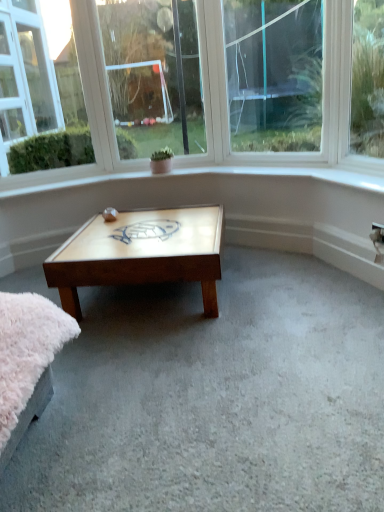
Identify the location of clear glass window at upper left, placed as the 3th window when sorted from right to left. (38, 97).

Describe the element at coordinates (110, 214) in the screenshot. I see `wooden turtle at center` at that location.

What do you see at coordinates (274, 74) in the screenshot?
I see `clear glass window at upper center, the 1th window when ordered from right to left` at bounding box center [274, 74].

Identify the location of clear glass window at upper center, positioned as the second window in right-to-left order. (154, 76).

Is clear glass window at upper center, positioned as the second window in right-to-left order, inside wooden turtle design at center?

No, clear glass window at upper center, positioned as the second window in right-to-left order, is not a part of wooden turtle design at center.

Considering the positions of objects wooden turtle design at center and clear glass window at upper center, which is the second window in left-to-right order, in the image provided, who is behind, wooden turtle design at center or clear glass window at upper center, which is the second window in left-to-right order,?

clear glass window at upper center, which is the second window in left-to-right order.

Is point (53, 274) positioned in front of point (183, 138)?

That is True.

From the image's perspective, which one is positioned higher, wooden turtle at center or wooden turtle design at center?

wooden turtle at center appears higher in the image.

From a real-world perspective, is wooden turtle at center physically below wooden turtle design at center?

Actually, wooden turtle at center is physically above wooden turtle design at center in the real world.

Does wooden turtle at center have a smaller size compared to wooden turtle design at center?

Indeed, wooden turtle at center has a smaller size compared to wooden turtle design at center.

From a real-world perspective, who is located higher, wooden turtle at center or clear glass window at upper left, placed as the 3th window when sorted from right to left?

In real-world perspective, clear glass window at upper left, placed as the 3th window when sorted from right to left, is above.

Considering the positions of objects wooden turtle at center and clear glass window at upper left, placed as the 3th window when sorted from right to left, in the image provided, who is behind, wooden turtle at center or clear glass window at upper left, placed as the 3th window when sorted from right to left,?

wooden turtle at center is behind.

Is wooden turtle at center to the right of clear glass window at upper left, the 1th window when ordered from left to right, from the viewer's perspective?

Yes.

Identify the location of table below the clear glass window at upper left, placed as the 3th window when sorted from right to left (from the image's perspective). The image size is (384, 512). (110, 214).

Does clear glass window at upper left, the 1th window when ordered from left to right, turn towards clear glass window at upper center, the 1th window when ordered from right to left?

No, clear glass window at upper left, the 1th window when ordered from left to right, is not aimed at clear glass window at upper center, the 1th window when ordered from right to left.

Is clear glass window at upper left, placed as the 3th window when sorted from right to left, next to clear glass window at upper center, the third window when ordered from left to right, and touching it?

No, clear glass window at upper left, placed as the 3th window when sorted from right to left, is not next to clear glass window at upper center, the third window when ordered from left to right.

Identify the location of window below the clear glass window at upper center, the 1th window when ordered from right to left (from the image's perspective). Image resolution: width=384 pixels, height=512 pixels. click(38, 97).

Looking at this image, from a real-world perspective, which is physically below, clear glass window at upper left, placed as the 3th window when sorted from right to left, or clear glass window at upper center, the 1th window when ordered from right to left?

clear glass window at upper center, the 1th window when ordered from right to left, is physically lower.

Considering the positions of point (73, 123) and point (170, 41), is point (73, 123) closer or farther from the camera than point (170, 41)?

Point (73, 123) is farther from the camera than point (170, 41).

Between clear glass window at upper left, placed as the 3th window when sorted from right to left, and clear glass window at upper center, which is the second window in left-to-right order, which one appears on the right side from the viewer's perspective?

From the viewer's perspective, clear glass window at upper center, which is the second window in left-to-right order, appears more on the right side.

Is clear glass window at upper left, the 1th window when ordered from left to right, taller than clear glass window at upper center, positioned as the second window in right-to-left order?

Yes, clear glass window at upper left, the 1th window when ordered from left to right, is taller than clear glass window at upper center, positioned as the second window in right-to-left order.

Is clear glass window at upper left, placed as the 3th window when sorted from right to left, facing away from clear glass window at upper center, positioned as the second window in right-to-left order?

No.

From a real-world perspective, is wooden turtle design at center positioned over wooden turtle at center based on gravity?

No.

From the image's perspective, which one is positioned lower, wooden turtle design at center or wooden turtle at center?

wooden turtle design at center is shown below in the image.

How many degrees apart are the facing directions of wooden turtle design at center and wooden turtle at center?

The facing directions of wooden turtle design at center and wooden turtle at center are 4.19 degrees apart.

Looking at this image, measure the distance from clear glass window at upper center, positioned as the second window in right-to-left order, to clear glass window at upper center, the 1th window when ordered from right to left.

clear glass window at upper center, positioned as the second window in right-to-left order, and clear glass window at upper center, the 1th window when ordered from right to left, are 53.28 centimeters apart from each other.

Considering the sizes of clear glass window at upper center, which is the second window in left-to-right order, and clear glass window at upper center, the 1th window when ordered from right to left, in the image, is clear glass window at upper center, which is the second window in left-to-right order, wider or thinner than clear glass window at upper center, the 1th window when ordered from right to left,?

Clearly, clear glass window at upper center, which is the second window in left-to-right order, has more width compared to clear glass window at upper center, the 1th window when ordered from right to left.

Are clear glass window at upper center, which is the second window in left-to-right order, and clear glass window at upper center, the third window when ordered from left to right, beside each other?

No, clear glass window at upper center, which is the second window in left-to-right order, is not making contact with clear glass window at upper center, the third window when ordered from left to right.

Which is more to the left, clear glass window at upper center, which is the second window in left-to-right order, or clear glass window at upper center, the 1th window when ordered from right to left?

Positioned to the left is clear glass window at upper center, which is the second window in left-to-right order.

Where is `the 3rd window positioned above the wooden turtle design at center (from the image's perspective)`? the 3rd window positioned above the wooden turtle design at center (from the image's perspective) is located at coordinates (154, 76).

Identify the location of table that appears on the left of wooden turtle design at center. (110, 214).

Consider the image. Looking at the image, which one is located further to wooden turtle at center, clear glass window at upper left, the 1th window when ordered from left to right, or wooden turtle design at center?

clear glass window at upper left, the 1th window when ordered from left to right.

From the image, which object appears to be nearer to clear glass window at upper left, placed as the 3th window when sorted from right to left, clear glass window at upper center, positioned as the second window in right-to-left order, or wooden turtle at center?

The object closer to clear glass window at upper left, placed as the 3th window when sorted from right to left, is clear glass window at upper center, positioned as the second window in right-to-left order.

Estimate the real-world distances between objects in this image. Which object is further from wooden turtle at center, wooden turtle design at center or clear glass window at upper center, the 1th window when ordered from right to left?

The object further to wooden turtle at center is clear glass window at upper center, the 1th window when ordered from right to left.

Estimate the real-world distances between objects in this image. Which object is further from clear glass window at upper center, which is the second window in left-to-right order, wooden turtle design at center or clear glass window at upper center, the 1th window when ordered from right to left?

wooden turtle design at center is positioned further to the anchor clear glass window at upper center, which is the second window in left-to-right order.

From the image, which object appears to be farther from clear glass window at upper left, the 1th window when ordered from left to right, clear glass window at upper center, the third window when ordered from left to right, or wooden turtle at center?

The object further to clear glass window at upper left, the 1th window when ordered from left to right, is clear glass window at upper center, the third window when ordered from left to right.

Looking at the image, which one is located closer to clear glass window at upper center, positioned as the second window in right-to-left order, wooden turtle at center or clear glass window at upper left, the 1th window when ordered from left to right?

Based on the image, clear glass window at upper left, the 1th window when ordered from left to right, appears to be nearer to clear glass window at upper center, positioned as the second window in right-to-left order.

From the image, which object appears to be nearer to clear glass window at upper center, the 1th window when ordered from right to left, wooden turtle at center or wooden turtle design at center?

wooden turtle design at center.

Considering their positions, is wooden turtle at center positioned further to wooden turtle design at center than clear glass window at upper center, the 1th window when ordered from right to left?

clear glass window at upper center, the 1th window when ordered from right to left, lies further to wooden turtle design at center than the other object.

Find the location of `window situated between clear glass window at upper left, placed as the 3th window when sorted from right to left, and clear glass window at upper center, the third window when ordered from left to right, from left to right`. window situated between clear glass window at upper left, placed as the 3th window when sorted from right to left, and clear glass window at upper center, the third window when ordered from left to right, from left to right is located at coordinates (154, 76).

The image size is (384, 512). Identify the location of table between clear glass window at upper center, the third window when ordered from left to right, and wooden turtle design at center in the up-down direction. (110, 214).

At what (x,y) coordinates should I click in order to perform the action: click on table between clear glass window at upper left, placed as the 3th window when sorted from right to left, and wooden turtle design at center vertically. Please return your answer as a coordinate pair (x, y). The image size is (384, 512). Looking at the image, I should click on (110, 214).

Locate an element on the screen. Image resolution: width=384 pixels, height=512 pixels. table that lies between clear glass window at upper center, positioned as the second window in right-to-left order, and wooden turtle design at center from top to bottom is located at coordinates (110, 214).